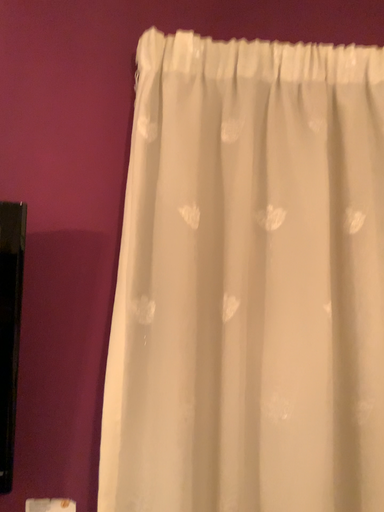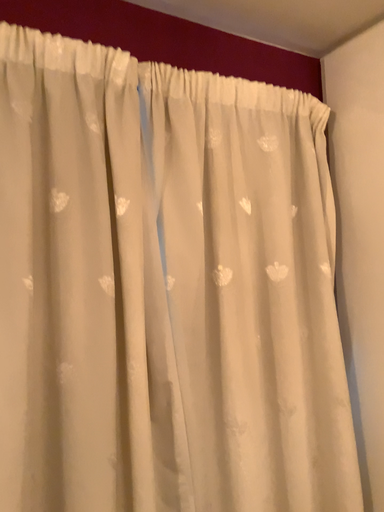
Question: Which way did the camera rotate in the video?

Choices:
 (A) rotated right
 (B) rotated left

Answer: (A)